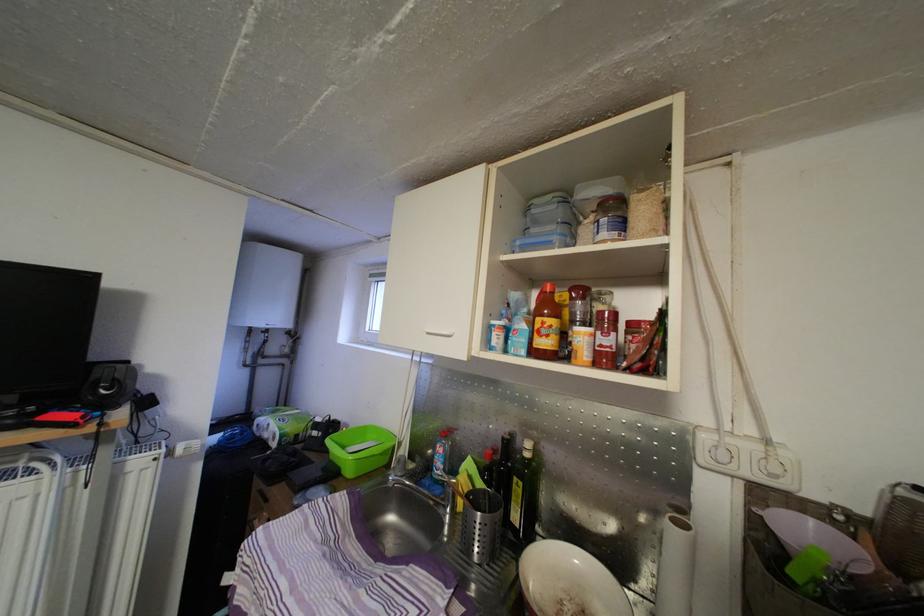
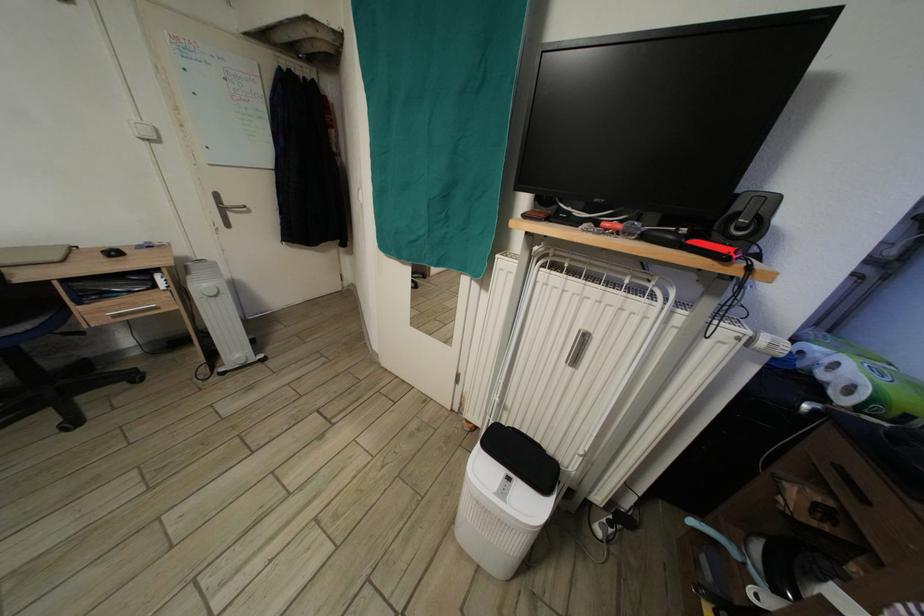
Where in the second image is the point corresponding to (273,442) from the first image?

(830, 383)